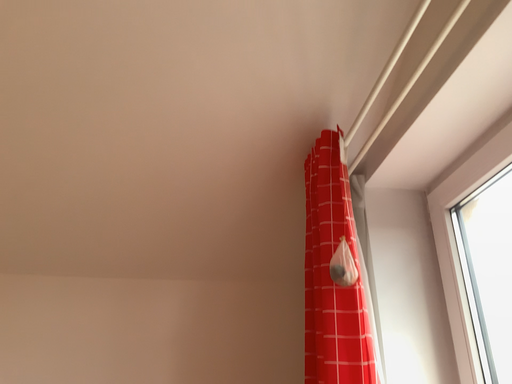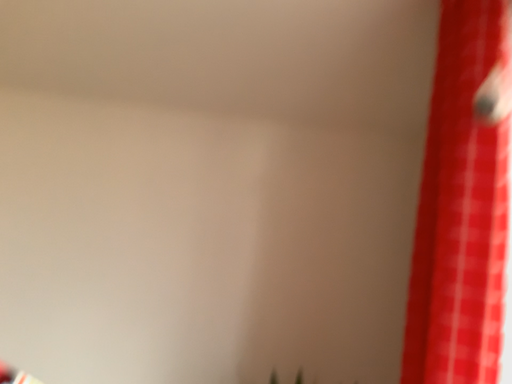
Question: How did the camera likely rotate when shooting the video?

Choices:
 (A) rotated downward
 (B) rotated upward

Answer: (A)